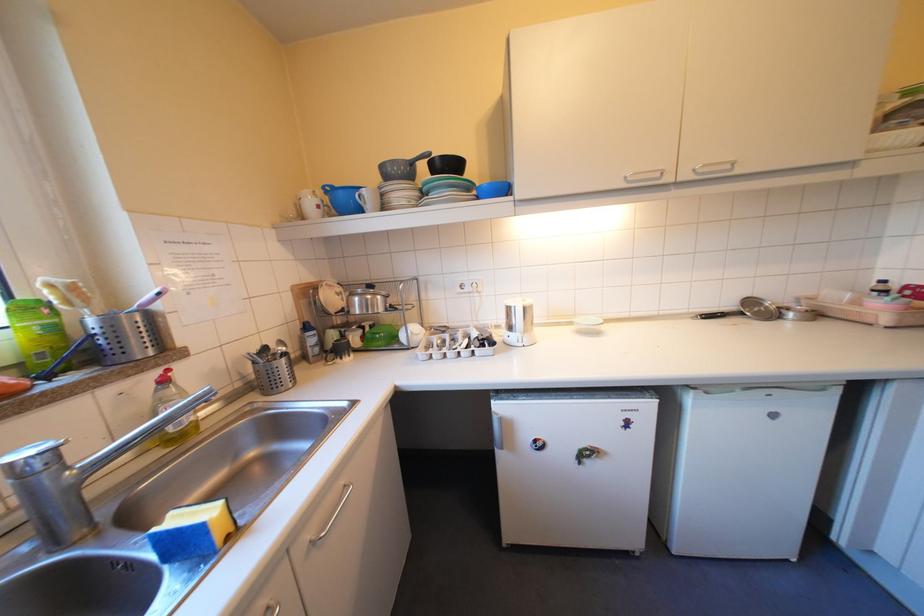
Image resolution: width=924 pixels, height=616 pixels. Find the location of `black mug handle`. black mug handle is located at coordinates (456, 164).